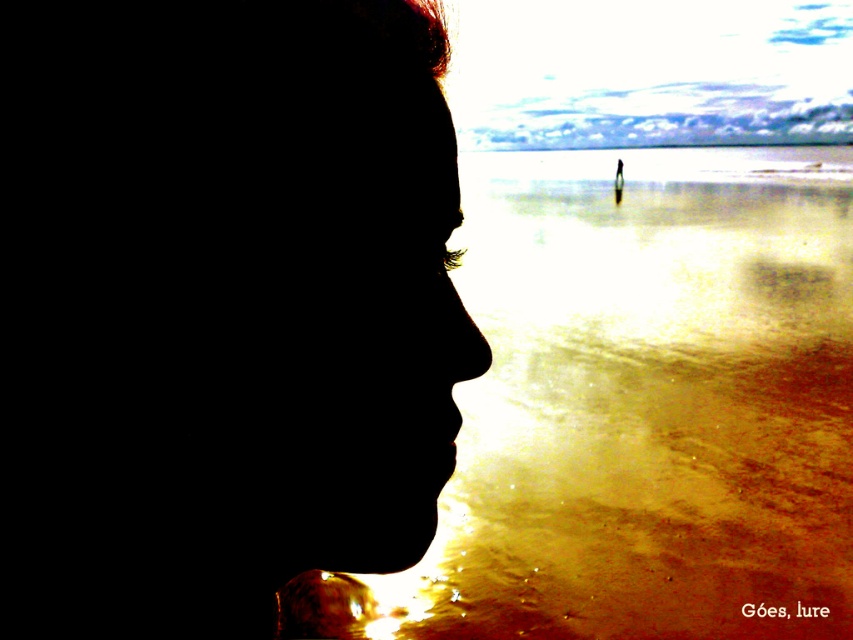
You are an artist analyzing the composition of this image. You notice the black matte face at left and the translucent golden water at center. Which object is positioned to the right of the other?

The translucent golden water at center is to the right of the black matte face at left.

You are an artist analyzing the composition of this image. The scene has a black matte face at left and a translucent golden water at center. Which object occupies more horizontal space in the image?

The translucent golden water at center occupies more horizontal space than the black matte face at left because it has a greater width according to the description.

You are an artist trying to paint the scene. You want to add a highlight on the point at point (219,307). Since the face is in silhouette, will the highlight be visible?

The point (219,307) is on black matte face at left, so the highlight will not be visible because the face is in silhouette and appears dark against the bright background.